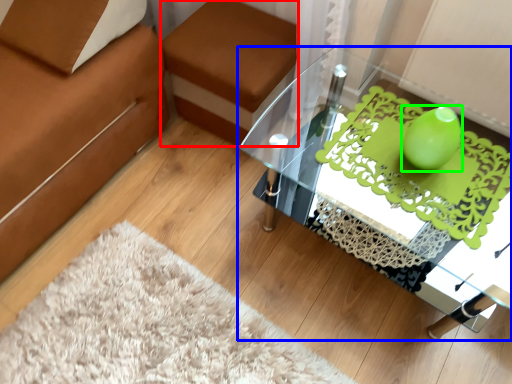
Question: Based on their relative distances, which object is farther from footrest (highlighted by a red box)? Choose from table (highlighted by a blue box) and teal (highlighted by a green box).

Choices:
 (A) table
 (B) teal

Answer: (B)